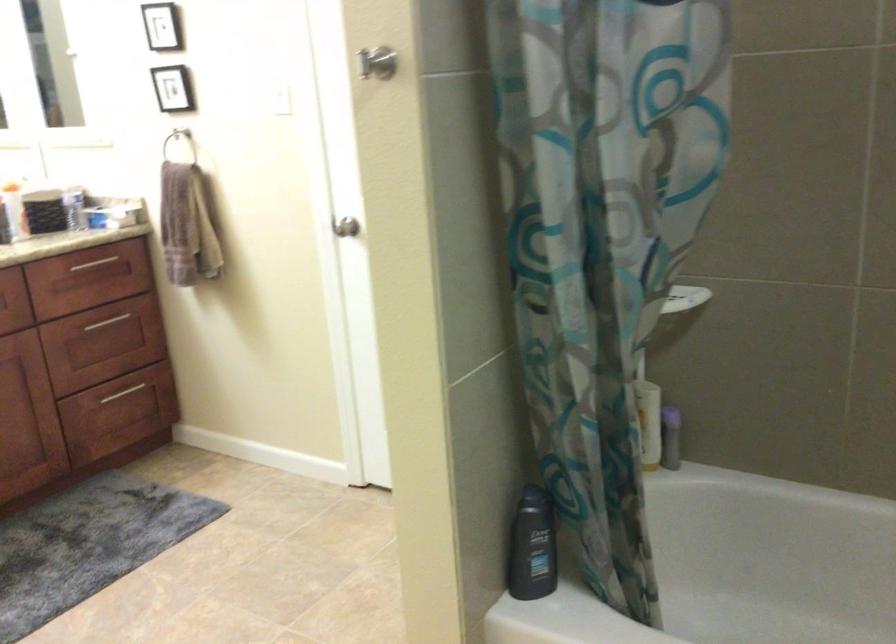
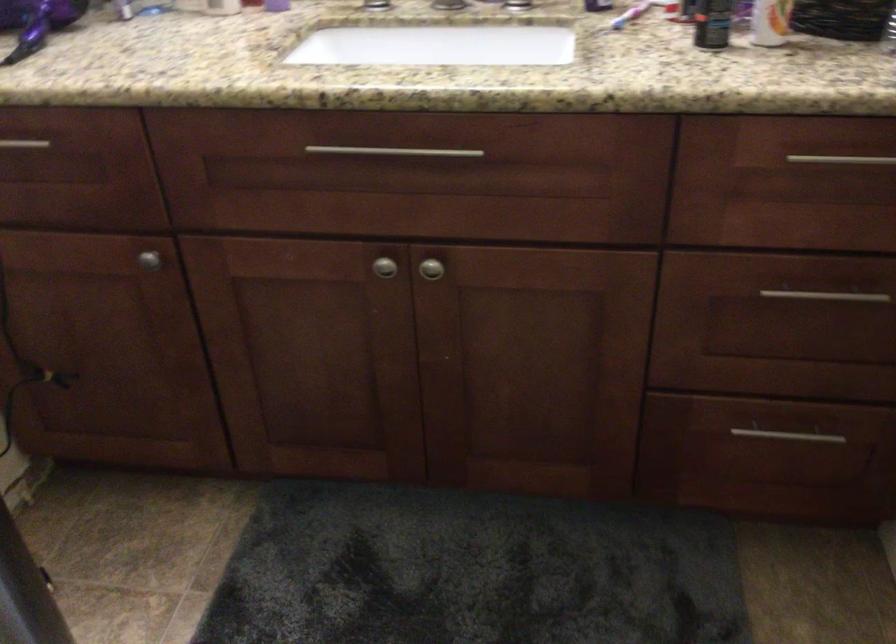
Where in the second image is the point corresponding to (97,261) from the first image?

(841, 158)